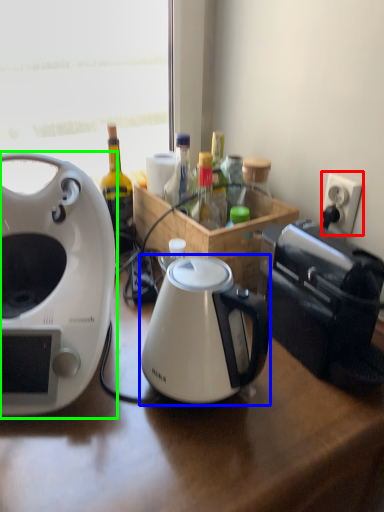
Question: Based on their relative distances, which object is farther from power outlet (highlighted by a red box)? Choose from kettle (highlighted by a blue box) and coffee maker (highlighted by a green box).

Choices:
 (A) kettle
 (B) coffee maker

Answer: (B)